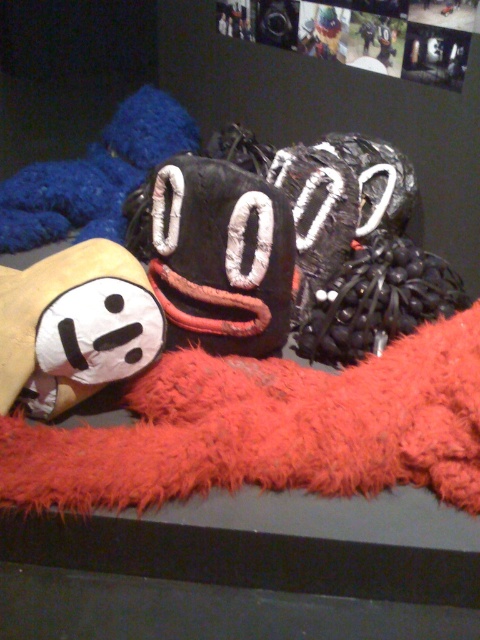
Does white plush toy at center appear under fuzzy blue plush at upper left?

Indeed, white plush toy at center is positioned under fuzzy blue plush at upper left.

Does point (128, 356) lie behind point (193, 140)?

That is False.

This screenshot has width=480, height=640. Identify the location of white plush toy at center. (x=74, y=326).